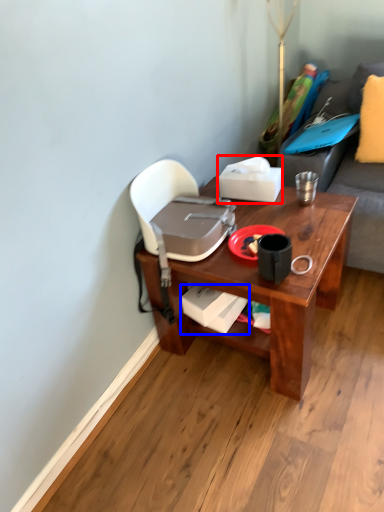
Question: Which point is closer to the camera, box (highlighted by a red box) or box (highlighted by a blue box)?

Choices:
 (A) box
 (B) box

Answer: (B)